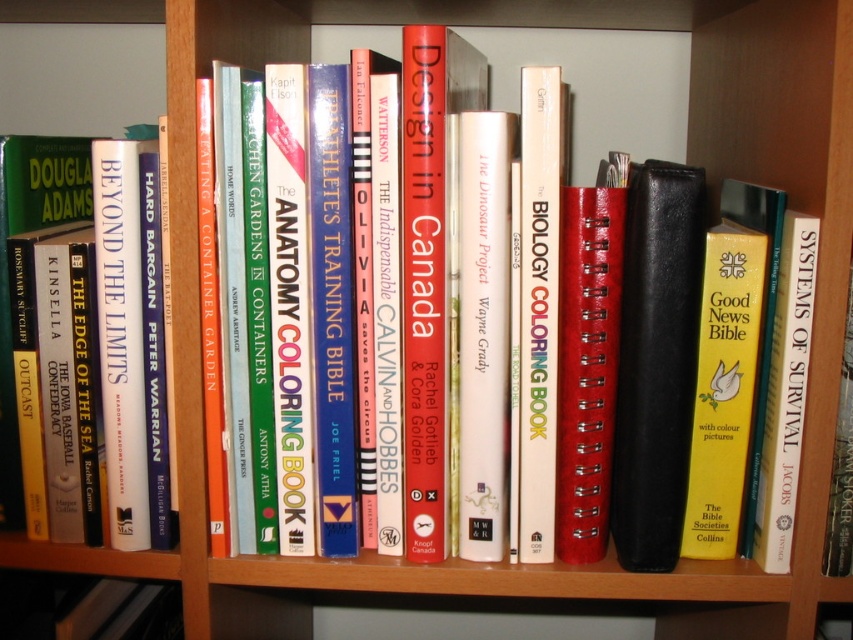
Who is shorter, hardback book at left or hardcover biology coloring book at center?

Standing shorter between the two is hardcover biology coloring book at center.

Consider the image. Can you confirm if hardback book at left is wider than hardcover biology coloring book at center?

Yes.

At what (x,y) coordinates should I click in order to perform the action: click on hardback book at left. Please return your answer as a coordinate pair (x, y). Looking at the image, I should click on point(38,337).